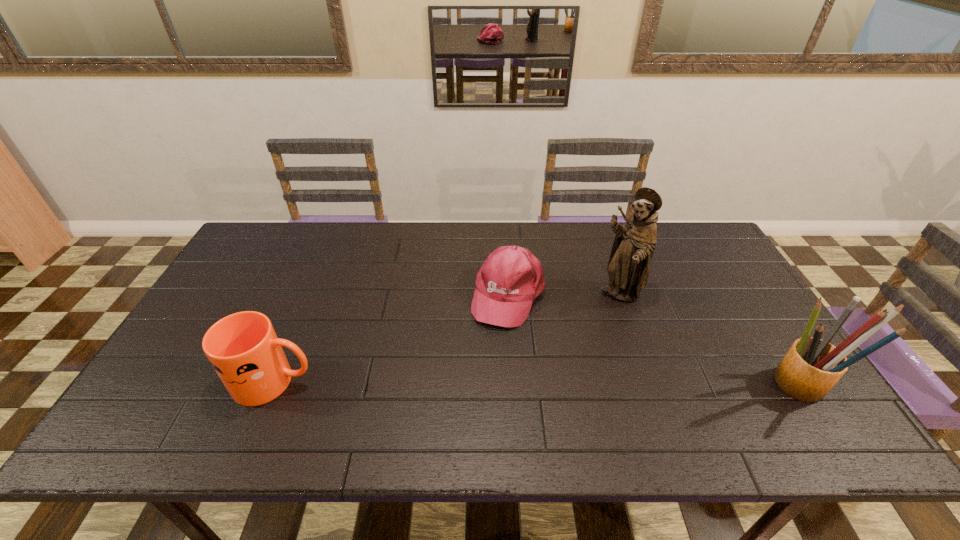
I want to click on free space on the desktop that is between the leftmost object and the second tallest object and is positioned on the front-facing side of the tallest object, so click(588, 383).

You are a GUI agent. You are given a task and a screenshot of the screen. Output one action in this format:
    pyautogui.click(x=<x>, y=<y>)
    Task: Click on the vacant spot on the desktop that is between the leftmost object and the third shortest object and is positioned at the front of the shortest object with the brim
    The width and height of the screenshot is (960, 540).
    Given the screenshot: What is the action you would take?
    pyautogui.click(x=472, y=382)